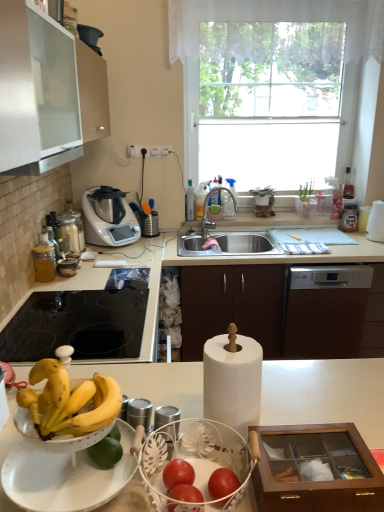
What do you see at coordinates (279, 20) in the screenshot? I see `white lace curtain at upper center` at bounding box center [279, 20].

The image size is (384, 512). Describe the element at coordinates (209, 209) in the screenshot. I see `matte silver faucet at sink center` at that location.

How much space does wooden box at lower right, which ranks as the 2th cabinetry in back-to-front order, occupy horizontally?

10.25 inches.

At what (x,y) coordinates should I click in order to perform the action: click on transparent glass window at upper center. Please return your answer as a coordinate pair (x, y). This screenshot has width=384, height=512. Looking at the image, I should click on (232, 20).

The image size is (384, 512). Identify the location of white paper towel at center. (326, 394).

Is white paper towel at center aimed at black glass cooktop at lower left?

No, white paper towel at center is not turned towards black glass cooktop at lower left.

From their relative heights in the image, would you say white paper towel at center is taller or shorter than black glass cooktop at lower left?

Considering their sizes, white paper towel at center has more height than black glass cooktop at lower left.

Is white paper towel at center to the right of black glass cooktop at lower left from the viewer's perspective?

Correct, you'll find white paper towel at center to the right of black glass cooktop at lower left.

Measure the distance from white paper towel at center to black glass cooktop at lower left.

white paper towel at center and black glass cooktop at lower left are 16.28 inches apart from each other.

From a real-world perspective, is wooden box at lower right, which ranks as the 2th cabinetry in back-to-front order, located beneath metallic silver food processor at center-left?

Correct, in the physical world, wooden box at lower right, which ranks as the 2th cabinetry in back-to-front order, is lower than metallic silver food processor at center-left.

Is metallic silver food processor at center-left surrounded by wooden box at lower right, which ranks as the 2th cabinetry in back-to-front order?

No, metallic silver food processor at center-left is located outside of wooden box at lower right, which ranks as the 2th cabinetry in back-to-front order.

Is metallic silver food processor at center-left at the back of wooden box at lower right, which ranks as the second cabinetry in top-to-bottom order?

No, wooden box at lower right, which ranks as the second cabinetry in top-to-bottom order,'s orientation is not away from metallic silver food processor at center-left.

Can you confirm if wooden box at lower right, which ranks as the 2th cabinetry in back-to-front order, is smaller than metallic silver food processor at center-left?

Yes.

Is black glass cooktop at lower left positioned with its back to white lace curtain at upper center?

That's not correct — black glass cooktop at lower left is not looking away from white lace curtain at upper center.

Considering the sizes of objects black glass cooktop at lower left and white lace curtain at upper center in the image provided, who is thinner, black glass cooktop at lower left or white lace curtain at upper center?

With smaller width is white lace curtain at upper center.

Which of these two, black glass cooktop at lower left or white lace curtain at upper center, stands shorter?

Standing shorter between the two is black glass cooktop at lower left.

Does point (116, 339) come farther from viewer compared to point (375, 9)?

No, (116, 339) is in front of (375, 9).

From the image's perspective, which one is positioned lower, brown matte cabinet at center, arranged as the 1th cabinetry when viewed from the top, or metallic silver food processor at center-left?

brown matte cabinet at center, arranged as the 1th cabinetry when viewed from the top, appears lower in the image.

Consider the image. Is brown matte cabinet at center, positioned as the 2th cabinetry in front-to-back order, inside or outside of metallic silver food processor at center-left?

brown matte cabinet at center, positioned as the 2th cabinetry in front-to-back order, lies outside metallic silver food processor at center-left.

Which of these two, brown matte cabinet at center, arranged as the 1th cabinetry when viewed from the top, or metallic silver food processor at center-left, is smaller?

Smaller between the two is metallic silver food processor at center-left.

Which point is more distant from viewer, (205, 297) or (111, 212)?

The point (111, 212) is behind.

Image resolution: width=384 pixels, height=512 pixels. I want to click on curtain located above the white plastic cup at right, the first appliance in the right-to-left sequence (from the image's perspective), so click(279, 20).

Consider the image. From the image's perspective, is white lace curtain at upper center located above or below white plastic cup at right, the first appliance in the right-to-left sequence?

From the image's perspective, white lace curtain at upper center appears above white plastic cup at right, the first appliance in the right-to-left sequence.

Who is shorter, white lace curtain at upper center or white plastic cup at right, which is counted as the second appliance, starting from the left?

Standing shorter between the two is white plastic cup at right, which is counted as the second appliance, starting from the left.

Is point (238, 5) positioned behind point (371, 240)?

No, (238, 5) is closer to viewer.

From a real-world perspective, who is located higher, metallic silver blender at upper right, which ranks as the second appliance in front-to-back order, or white paper towel at center?

metallic silver blender at upper right, which ranks as the second appliance in front-to-back order, from a real-world perspective.

Looking at this image, from the image's perspective, is metallic silver blender at upper right, which ranks as the second appliance in front-to-back order, above or below white paper towel at center?

Based on their image positions, metallic silver blender at upper right, which ranks as the second appliance in front-to-back order, is located above white paper towel at center.

Considering the sizes of objects metallic silver blender at upper right, which is the first appliance in back-to-front order, and white paper towel at center in the image provided, who is smaller, metallic silver blender at upper right, which is the first appliance in back-to-front order, or white paper towel at center?

metallic silver blender at upper right, which is the first appliance in back-to-front order, is smaller.

Does wooden box at lower right, placed as the 1th cabinetry when sorted from bottom to top, appear on the right side of metallic silver blender at upper right, acting as the 2th appliance starting from the right?

No, wooden box at lower right, placed as the 1th cabinetry when sorted from bottom to top, is not to the right of metallic silver blender at upper right, acting as the 2th appliance starting from the right.

Which object is more forward, wooden box at lower right, the first cabinetry when ordered from front to back, or metallic silver blender at upper right, acting as the 2th appliance starting from the right?

wooden box at lower right, the first cabinetry when ordered from front to back.

Could you measure the distance between wooden box at lower right, which ranks as the 2th cabinetry in back-to-front order, and metallic silver blender at upper right, the first appliance viewed from the left?

A distance of 2.26 meters exists between wooden box at lower right, which ranks as the 2th cabinetry in back-to-front order, and metallic silver blender at upper right, the first appliance viewed from the left.

Can you confirm if wooden box at lower right, placed as the 1th cabinetry when sorted from bottom to top, is thinner than metallic silver blender at upper right, the first appliance viewed from the left?

In fact, wooden box at lower right, placed as the 1th cabinetry when sorted from bottom to top, might be wider than metallic silver blender at upper right, the first appliance viewed from the left.

Where is `countertop in front of the black glass cooktop at lower left`? This screenshot has height=512, width=384. countertop in front of the black glass cooktop at lower left is located at coordinates (326, 394).

The image size is (384, 512). I want to click on the 1st cabinetry positioned below the metallic silver food processor at center-left (from a real-world perspective), so click(316, 469).

Considering their positions, is brown matte cabinet at center, arranged as the 1th cabinetry when viewed from the top, positioned further to white lace curtain at upper center than white paper towel at center?

Among the two, white paper towel at center is located further to white lace curtain at upper center.

Based on their spatial positions, is transparent glass window at upper center or wooden box at lower right, placed as the 1th cabinetry when sorted from bottom to top, closer to metallic silver food processor at center-left?

The object closer to metallic silver food processor at center-left is transparent glass window at upper center.

Which object lies nearer to the anchor point matte silver faucet at sink center, wooden box at lower right, which ranks as the 2th cabinetry in back-to-front order, or transparent glass window at upper center?

Among the two, transparent glass window at upper center is located nearer to matte silver faucet at sink center.

Based on their spatial positions, is white lace curtain at upper center or metallic silver blender at upper right, acting as the 2th appliance starting from the right, closer to white plastic cup at right, which appears as the second appliance when viewed from the back?

metallic silver blender at upper right, acting as the 2th appliance starting from the right, lies closer to white plastic cup at right, which appears as the second appliance when viewed from the back, than the other object.

When comparing their distances from white paper towel at center, does transparent glass window at upper center or matte silver faucet at sink center seem further?

Among the two, transparent glass window at upper center is located further to white paper towel at center.

Considering their positions, is matte silver faucet at sink center positioned closer to black glass cooktop at lower left than metallic silver blender at upper right, the first appliance viewed from the left?

matte silver faucet at sink center is closer to black glass cooktop at lower left.

Considering their positions, is white lace curtain at upper center positioned further to brown matte cabinet at center, arranged as the second cabinetry when ordered from the bottom, than metallic silver food processor at center-left?

white lace curtain at upper center is positioned further to the anchor brown matte cabinet at center, arranged as the second cabinetry when ordered from the bottom.

Based on their spatial positions, is matte silver faucet at sink center or white paper towel at center further from black glass cooktop at lower left?

Among the two, matte silver faucet at sink center is located further to black glass cooktop at lower left.

Where is `appliance between metallic silver food processor at center-left and white plastic cup at right, the first appliance in the right-to-left sequence`? The height and width of the screenshot is (512, 384). appliance between metallic silver food processor at center-left and white plastic cup at right, the first appliance in the right-to-left sequence is located at coordinates (349, 218).

You are a GUI agent. You are given a task and a screenshot of the screen. Output one action in this format:
    pyautogui.click(x=<x>, y=<y>)
    Task: Click on the cabinetry between wooden box at lower right, placed as the 1th cabinetry when sorted from bottom to top, and metallic silver blender at upper right, which is the first appliance in back-to-front order, from front to back
    
    Given the screenshot: What is the action you would take?
    pyautogui.click(x=232, y=305)

Find the location of a particular element. This screenshot has height=512, width=384. cabinetry positioned between black glass cooktop at lower left and metallic silver blender at upper right, which ranks as the second appliance in front-to-back order, from near to far is located at coordinates (232, 305).

This screenshot has width=384, height=512. Identify the location of cabinetry between wooden box at lower right, placed as the 1th cabinetry when sorted from bottom to top, and white plastic cup at right, which appears as the 1th appliance when viewed from the front, in the front-back direction. (232, 305).